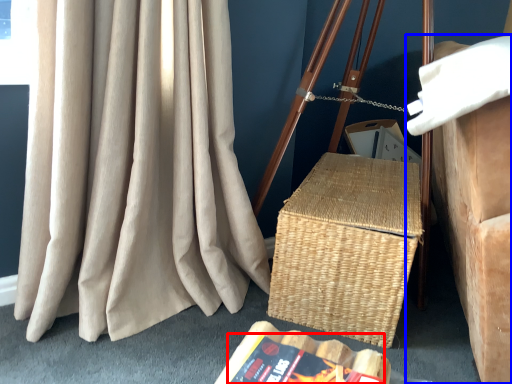
Question: Which object is closer to the camera taking this photo, paperback book (highlighted by a red box) or furniture (highlighted by a blue box)?

Choices:
 (A) paperback book
 (B) furniture

Answer: (B)